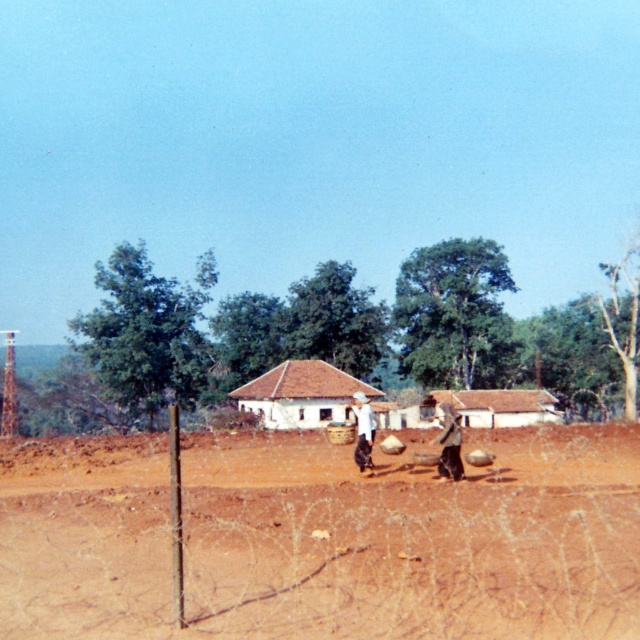
Question: Does white clay house at center appear on the right side of white fabric hat at center?

Choices:
 (A) yes
 (B) no

Answer: (A)

Question: Which point is closer to the camera?

Choices:
 (A) (372, 573)
 (B) (449, 413)
 (C) (488, 406)
 (D) (356, 422)

Answer: (A)

Question: Is brown fabric bag at center closer to the viewer compared to white fabric hat at center?

Choices:
 (A) no
 (B) yes

Answer: (B)

Question: Which of these objects is positioned farthest from the brown dirt field at center?

Choices:
 (A) brown corrugated metal hut at center
 (B) brown clay hut at center
 (C) brown fabric bag at center
 (D) white clay house at center

Answer: (A)

Question: Which object is positioned farthest from the white fabric hat at center?

Choices:
 (A) white clay house at center
 (B) brown fabric bag at center
 (C) brown dirt field at center
 (D) brown clay hut at center

Answer: (A)

Question: Is brown dirt field at center above white fabric hat at center?

Choices:
 (A) yes
 (B) no

Answer: (A)